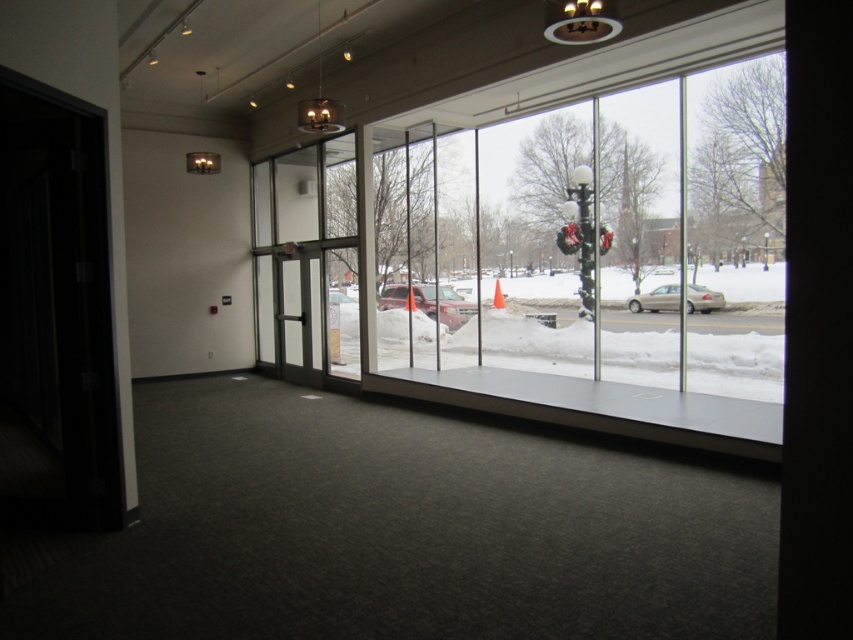
Question: Is clear glass door at center thinner than matte red suv at center?

Choices:
 (A) yes
 (B) no

Answer: (A)

Question: Which object is closer to the camera taking this photo?

Choices:
 (A) matte red suv at center
 (B) clear glass door at center

Answer: (B)

Question: Which of the following is the farthest from the observer?

Choices:
 (A) matte red suv at center
 (B) satin beige sedan at center
 (C) transparent glass window at center
 (D) clear glass door at center

Answer: (A)

Question: Can you confirm if transparent glass window at center is positioned below satin beige sedan at center?

Choices:
 (A) yes
 (B) no

Answer: (B)

Question: Does transparent glass window at center appear on the left side of satin beige sedan at center?

Choices:
 (A) yes
 (B) no

Answer: (A)

Question: Which object appears closest to the camera in this image?

Choices:
 (A) matte red suv at center
 (B) transparent glass window at center
 (C) satin beige sedan at center
 (D) clear glass door at center

Answer: (B)